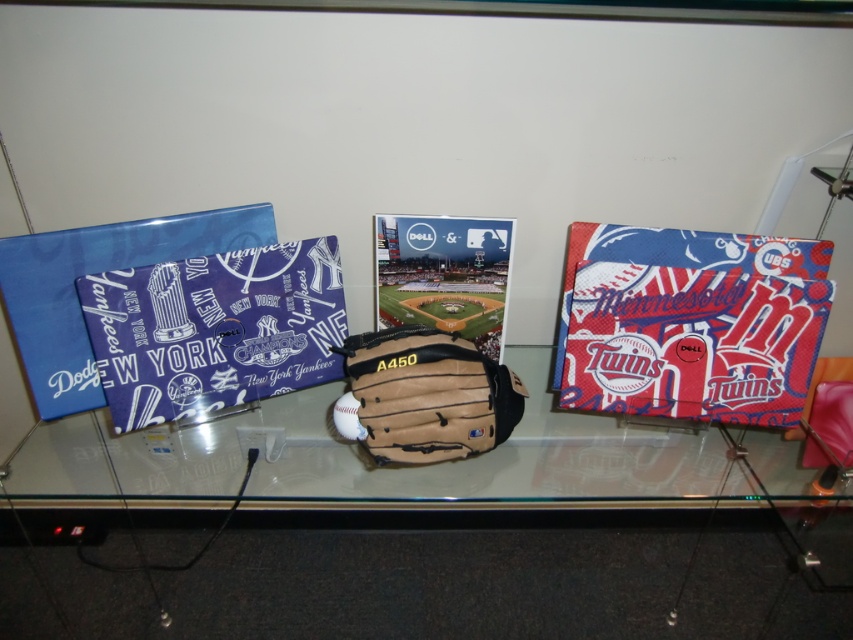
Question: Considering the real-world distances, which object is closest to the brown leather baseball glove at center?

Choices:
 (A) white matte baseball at center
 (B) transparent glass table at center

Answer: (A)

Question: Which point is farther to the camera?

Choices:
 (A) brown leather baseball glove at center
 (B) white matte baseball at center

Answer: (B)

Question: Does transparent glass table at center have a lesser width compared to brown leather baseball glove at center?

Choices:
 (A) no
 (B) yes

Answer: (A)

Question: Where is transparent glass table at center located in relation to white matte baseball at center in the image?

Choices:
 (A) above
 (B) below

Answer: (B)

Question: Which object appears closest to the camera in this image?

Choices:
 (A) white matte baseball at center
 (B) transparent glass table at center

Answer: (B)

Question: Is transparent glass table at center thinner than brown leather baseball glove at center?

Choices:
 (A) yes
 (B) no

Answer: (B)